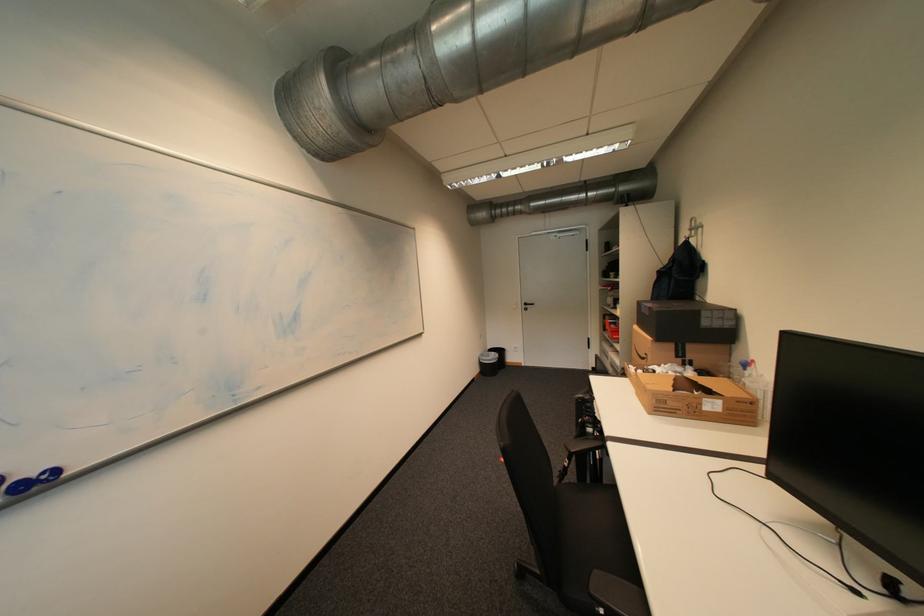
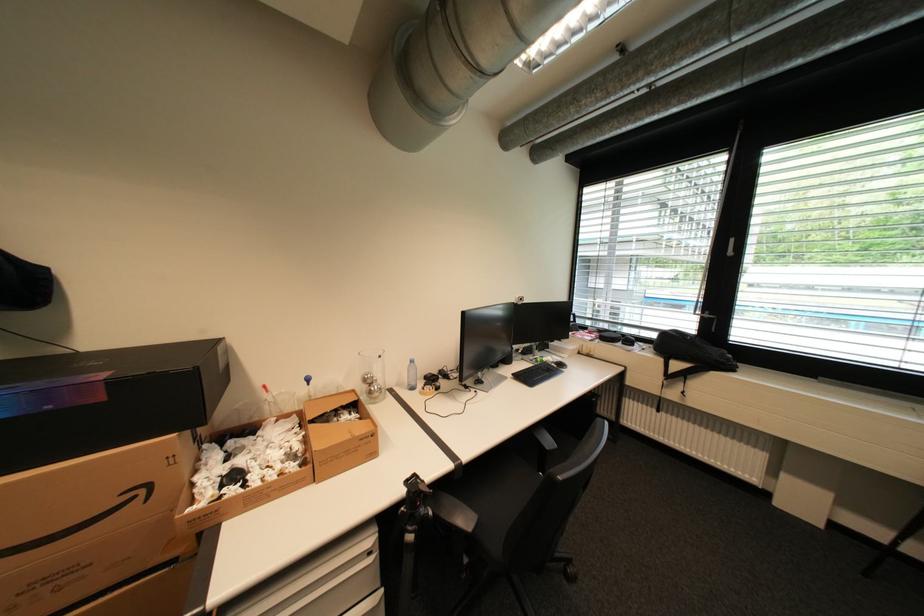
The point at (651,387) is marked in the first image. Where is the corresponding point in the second image?

(370, 440)